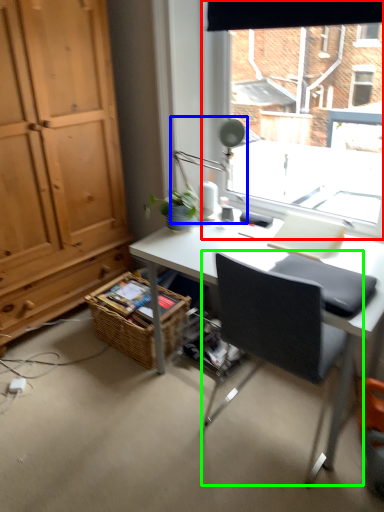
Question: Which is nearer to the window (highlighted by a red box)? table lamp (highlighted by a blue box) or chair (highlighted by a green box).

Choices:
 (A) table lamp
 (B) chair

Answer: (A)